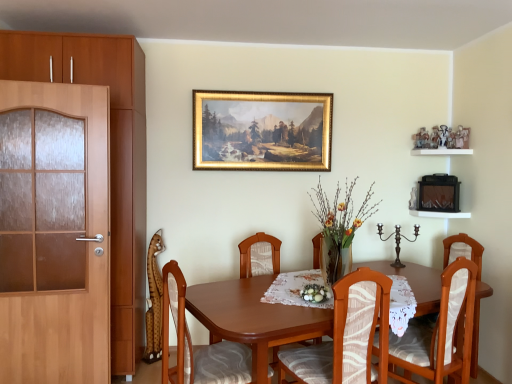
Question: From a real-world perspective, is white fabric floral arrangement at center, which is the 2th floral arrangement from top to bottom, physically below wooden chair with patterned cushion at center, which is counted as the first chair, starting from the left?

Choices:
 (A) no
 (B) yes

Answer: (A)

Question: Can you confirm if white fabric floral arrangement at center, which is the 2th floral arrangement from top to bottom, is smaller than wooden chair with patterned cushion at center, which is counted as the first chair, starting from the left?

Choices:
 (A) yes
 (B) no

Answer: (A)

Question: Is wooden chair with patterned cushion at center, which is counted as the first chair, starting from the left, located within white fabric floral arrangement at center, the 1th floral arrangement in the bottom-to-top sequence?

Choices:
 (A) no
 (B) yes

Answer: (A)

Question: Is white fabric floral arrangement at center, the 1th floral arrangement in the bottom-to-top sequence, facing towards wooden chair with patterned cushion at center, which is counted as the first chair, starting from the left?

Choices:
 (A) no
 (B) yes

Answer: (A)

Question: Does white fabric floral arrangement at center, the 1th floral arrangement in the bottom-to-top sequence, have a lesser width compared to wooden chair with patterned cushion at center, which is counted as the first chair, starting from the left?

Choices:
 (A) yes
 (B) no

Answer: (A)

Question: From the image's perspective, is white lace tablecloth at center positioned above or below gold-framed painting at upper center?

Choices:
 (A) below
 (B) above

Answer: (A)

Question: In the image, is white lace tablecloth at center on the left side or the right side of gold-framed painting at upper center?

Choices:
 (A) right
 (B) left

Answer: (A)

Question: Is white lace tablecloth at center bigger or smaller than gold-framed painting at upper center?

Choices:
 (A) small
 (B) big

Answer: (B)

Question: Is point (412, 296) closer or farther from the camera than point (217, 152)?

Choices:
 (A) farther
 (B) closer

Answer: (B)

Question: Looking at the image, does matte wood cabinet at left seem bigger or smaller compared to gold-framed painting at upper center?

Choices:
 (A) small
 (B) big

Answer: (B)

Question: From the image's perspective, is matte wood cabinet at left located above or below gold-framed painting at upper center?

Choices:
 (A) above
 (B) below

Answer: (B)

Question: Considering their positions, is matte wood cabinet at left located in front of or behind gold-framed painting at upper center?

Choices:
 (A) behind
 (B) front

Answer: (B)

Question: From a real-world perspective, relative to gold-framed painting at upper center, is matte wood cabinet at left vertically above or below?

Choices:
 (A) below
 (B) above

Answer: (A)

Question: In terms of height, does wooden chair with white cushion at center, the 4th chair in the left-to-right sequence, look taller or shorter compared to wooden chair with patterned cushion at center, marked as the 3th chair in a left-to-right arrangement?

Choices:
 (A) short
 (B) tall

Answer: (B)

Question: From the image's perspective, is wooden chair with white cushion at center, the 4th chair in the left-to-right sequence, located above or below wooden chair with patterned cushion at center, marked as the 3th chair in a left-to-right arrangement?

Choices:
 (A) above
 (B) below

Answer: (B)